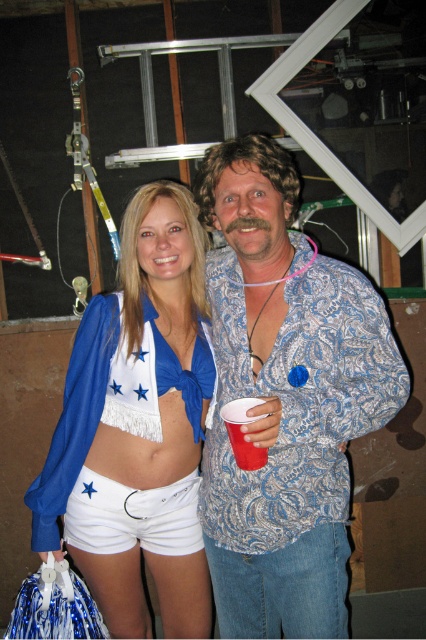
You are standing at the origin point in the image. There are two points marked in the image, point (57, 440) and point (28, 595). Which point is closer to you?

Point (57, 440) is in front of point (28, 595), so it is closer to you.